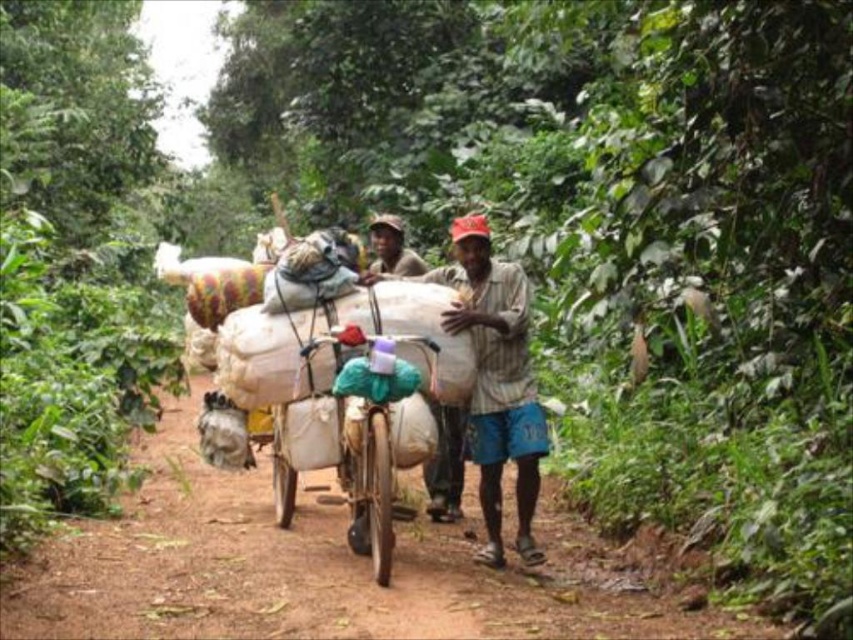
Question: Which object is the closest to the brown dirt track at center?

Choices:
 (A) brown striped shirt at center
 (B) matte brown hat at center

Answer: (B)

Question: Does brown dirt track at center come behind matte brown hat at center?

Choices:
 (A) no
 (B) yes

Answer: (B)

Question: Based on their relative distances, which object is nearer to the brown dirt track at center?

Choices:
 (A) matte brown hat at center
 (B) brown striped shirt at center

Answer: (A)

Question: Which point is farther to the camera?

Choices:
 (A) (381, 253)
 (B) (483, 237)
 (C) (395, 636)

Answer: (A)

Question: Does brown dirt track at center appear under matte brown hat at center?

Choices:
 (A) yes
 (B) no

Answer: (A)

Question: Can you confirm if brown dirt track at center is thinner than matte brown hat at center?

Choices:
 (A) yes
 (B) no

Answer: (B)